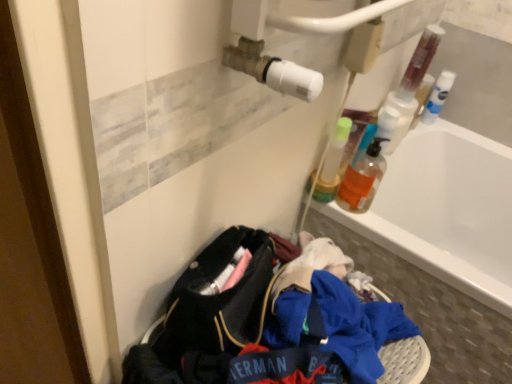
Question: Considering the relative sizes of translucent plastic bottle at upper right, the second bottle from the back, and translucent plastic bottle at upper right in the image provided, is translucent plastic bottle at upper right, the second bottle from the back, taller than translucent plastic bottle at upper right?

Choices:
 (A) yes
 (B) no

Answer: (A)

Question: Is translucent plastic bottle at upper right, which appears as the 3th bottle when viewed from the right, at the right side of translucent plastic bottle at upper right?

Choices:
 (A) no
 (B) yes

Answer: (A)

Question: Can you confirm if translucent plastic bottle at upper right, which is counted as the 2th bottle, starting from the front, is smaller than translucent plastic bottle at upper right?

Choices:
 (A) yes
 (B) no

Answer: (B)

Question: Is translucent plastic bottle at upper right, the second bottle from the back, further to the viewer compared to translucent plastic bottle at upper right?

Choices:
 (A) yes
 (B) no

Answer: (B)

Question: From the image's perspective, would you say translucent plastic bottle at upper right, which is counted as the 2th bottle, starting from the front, is positioned over translucent plastic bottle at upper right?

Choices:
 (A) yes
 (B) no

Answer: (B)

Question: Does translucent plastic bottle at upper right, which is counted as the first bottle, starting from the left, have a lesser height compared to translucent plastic bottle at upper right?

Choices:
 (A) no
 (B) yes

Answer: (A)

Question: Is white plastic bottle at upper right, which is the third bottle from left to right, located within white glossy bathtub at upper right?

Choices:
 (A) no
 (B) yes

Answer: (A)

Question: Is white glossy bathtub at upper right wider than white plastic bottle at upper right, which is the 3th bottle from front to back?

Choices:
 (A) yes
 (B) no

Answer: (A)

Question: Is white glossy bathtub at upper right closer to the viewer compared to white plastic bottle at upper right, which is the 3th bottle from front to back?

Choices:
 (A) yes
 (B) no

Answer: (A)

Question: From the image's perspective, is white glossy bathtub at upper right below white plastic bottle at upper right, which is the third bottle from left to right?

Choices:
 (A) yes
 (B) no

Answer: (A)

Question: Is white glossy bathtub at upper right thinner than white plastic bottle at upper right, which is the 3th bottle from front to back?

Choices:
 (A) yes
 (B) no

Answer: (B)

Question: Considering the relative positions of white glossy bathtub at upper right and white plastic bottle at upper right, which is counted as the first bottle, starting from the back, in the image provided, is white glossy bathtub at upper right to the right of white plastic bottle at upper right, which is counted as the first bottle, starting from the back, from the viewer's perspective?

Choices:
 (A) yes
 (B) no

Answer: (B)

Question: Can you confirm if white glossy bathtub at upper right is positioned to the left of translucent plastic bottle at upper right, the second bottle from the back?

Choices:
 (A) no
 (B) yes

Answer: (A)